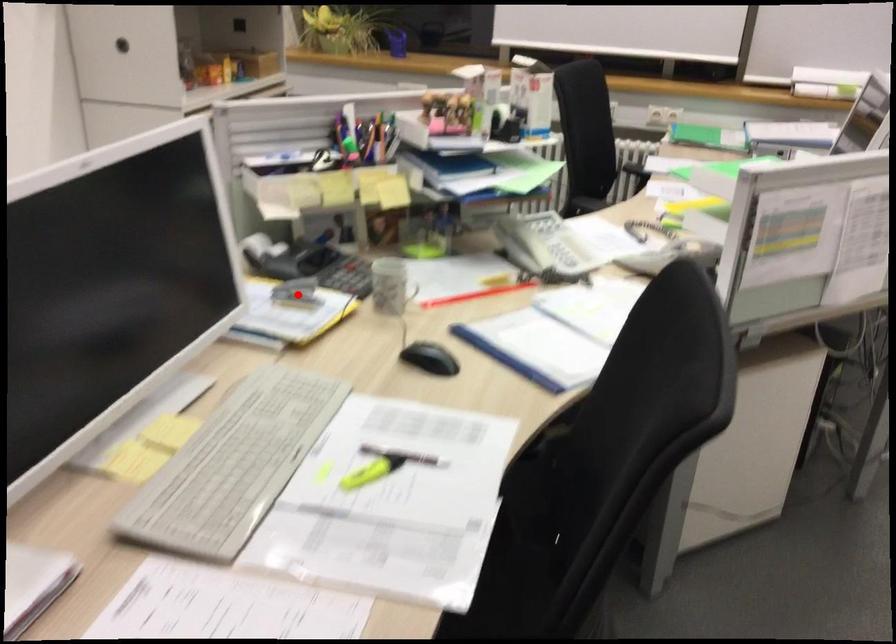
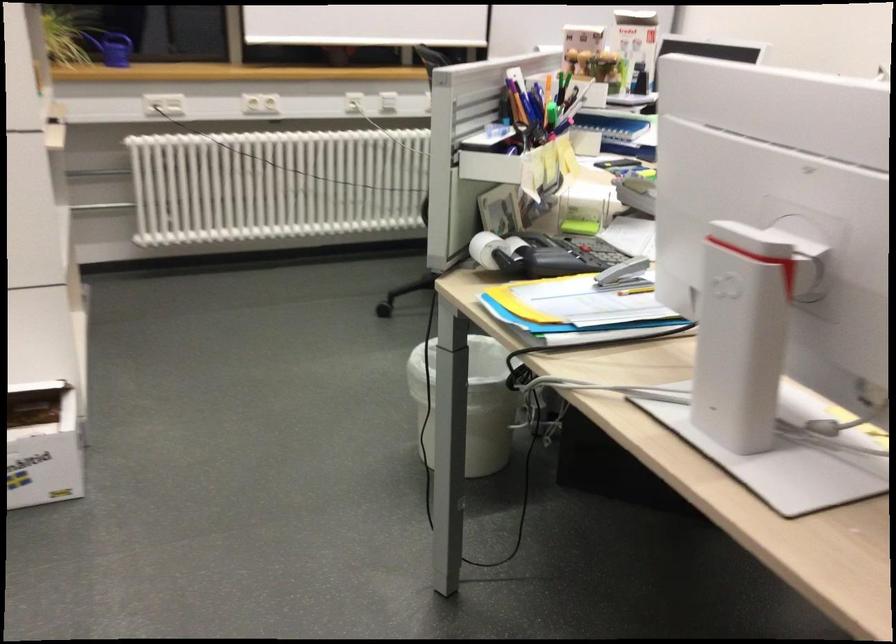
Question: I am providing you with two images of the same scene from different viewpoints. A red point is shown in image1. For the corresponding object point in image2, is it positioned nearer or farther from the camera?

Choices:
 (A) Nearer
 (B) Farther

Answer: (A)